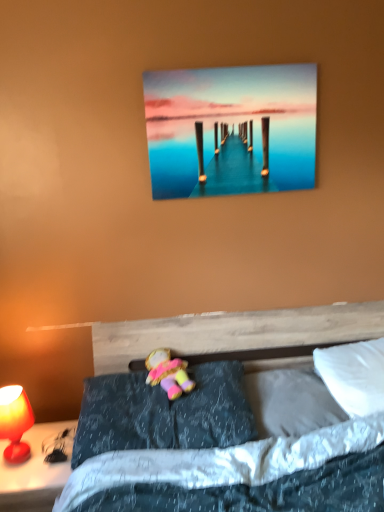
This screenshot has height=512, width=384. Find the location of `free space behind matte red lamp at left`. free space behind matte red lamp at left is located at coordinates (41, 433).